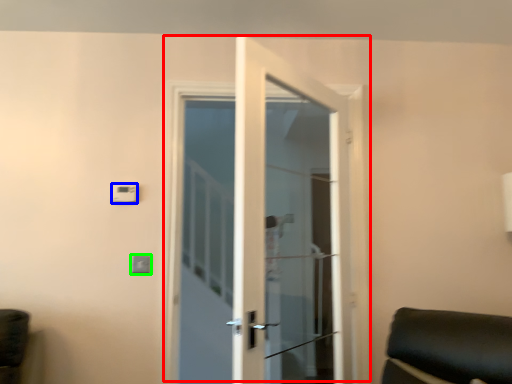
Question: Based on their relative distances, which object is nearer to door (highlighted by a red box)? Choose from light switch (highlighted by a blue box) and light switch (highlighted by a green box).

Choices:
 (A) light switch
 (B) light switch

Answer: (B)